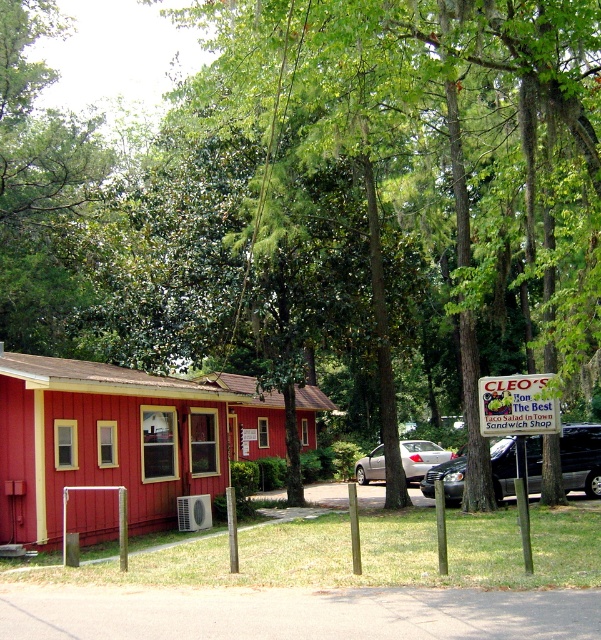
Question: Where is green leafy tree at center located in relation to shiny black sedan at center in the image?

Choices:
 (A) above
 (B) below

Answer: (A)

Question: Among these points, which one is farthest from the camera?

Choices:
 (A) (79, 376)
 (B) (575, 474)
 (C) (379, 452)

Answer: (C)

Question: Does shiny black sedan at center appear on the right side of red wood cabin at center?

Choices:
 (A) yes
 (B) no

Answer: (A)

Question: Which object appears closest to the camera in this image?

Choices:
 (A) matte wood cabin at center
 (B) red wood cabin at center

Answer: (A)

Question: Can you confirm if matte wood cabin at center is positioned to the right of shiny black sedan at center?

Choices:
 (A) yes
 (B) no

Answer: (B)

Question: Which object is closer to the camera taking this photo?

Choices:
 (A) silver metallic sedan at center
 (B) red wood cabin at center

Answer: (B)